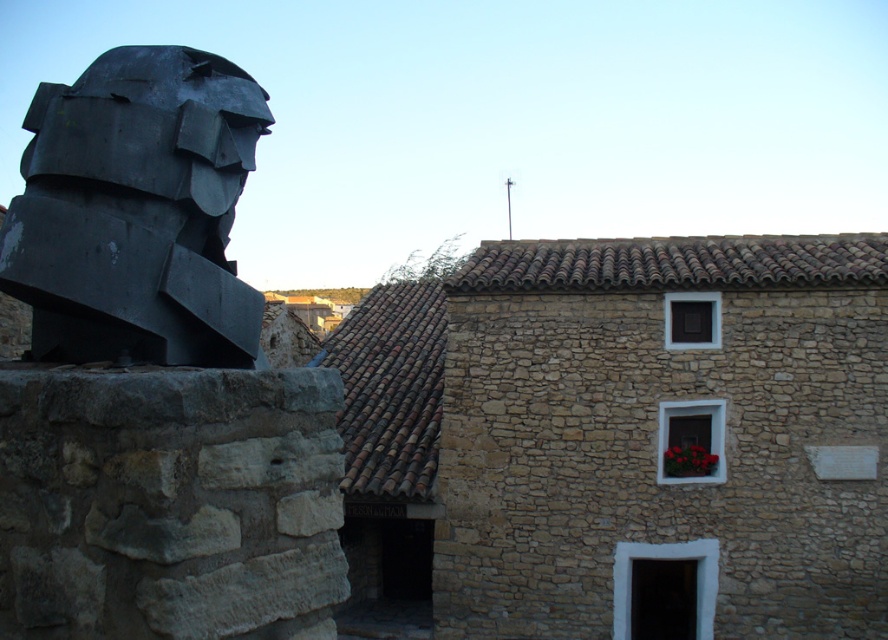
Consider the image. Can you confirm if matte black sculpture at left is positioned to the right of red matte flower box at center?

In fact, matte black sculpture at left is to the left of red matte flower box at center.

Is matte black sculpture at left in front of red matte flower box at center?

Yes, it is in front of red matte flower box at center.

At what (x,y) coordinates should I click in order to perform the action: click on matte black sculpture at left. Please return your answer as a coordinate pair (x, y). The width and height of the screenshot is (888, 640). Looking at the image, I should click on (137, 211).